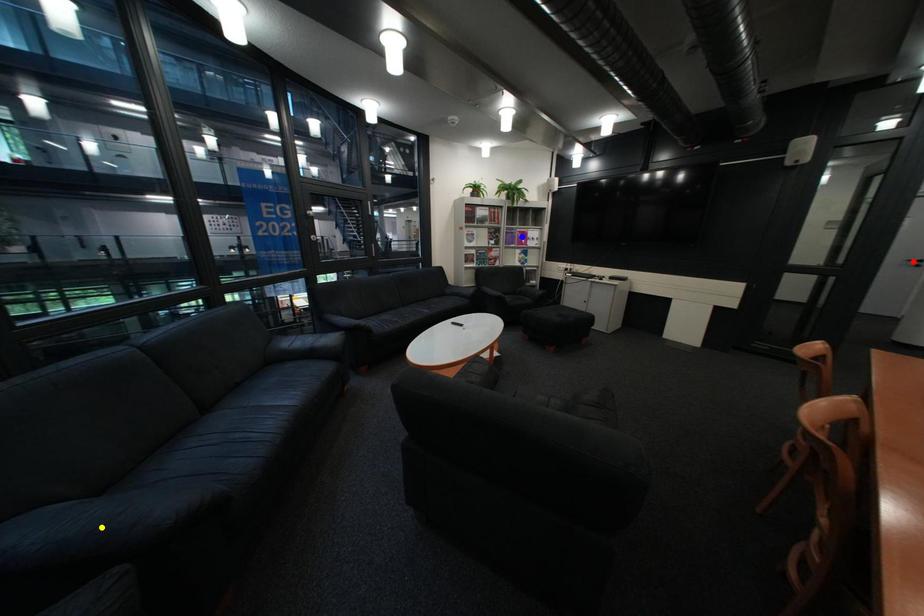
Order these from nearest to farthest:
A) red point
B) yellow point
C) blue point

blue point, red point, yellow point